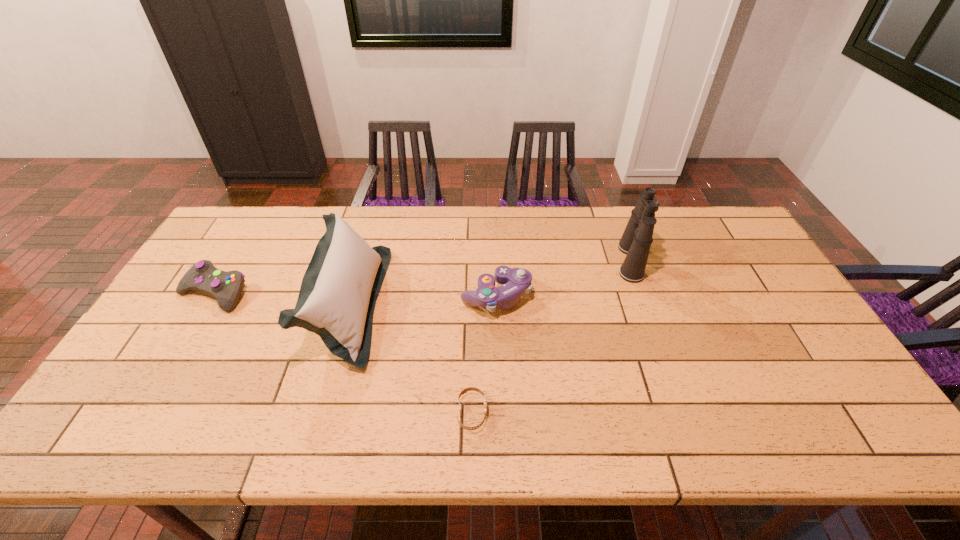
Image resolution: width=960 pixels, height=540 pixels. Find the location of `vacant space positioned 0.120m on the right of the tallest object`. vacant space positioned 0.120m on the right of the tallest object is located at coordinates (684, 261).

At what (x,y) coordinates should I click in order to perform the action: click on vacant position located 0.390m on the surface of the cushion. Please return your answer as a coordinate pair (x, y). The height and width of the screenshot is (540, 960). Looking at the image, I should click on (516, 305).

Identify the location of vacant space situated 0.090m on the back of the taller control. (494, 255).

The image size is (960, 540). Identify the location of blank area located 0.260m on the right of the shorter control. (337, 293).

At what (x,y) coordinates should I click in order to perform the action: click on blank space located 0.130m on the face of the shortest object. Please return your answer as a coordinate pair (x, y). Image resolution: width=960 pixels, height=540 pixels. Looking at the image, I should click on (542, 413).

Identify the location of object located at the far edge. (636, 240).

At what (x,y) coordinates should I click in order to perform the action: click on object situated at the near edge. Please return your answer as a coordinate pair (x, y). The image size is (960, 540). Looking at the image, I should click on (464, 390).

This screenshot has width=960, height=540. What are the coordinates of `object at the left edge` in the screenshot? It's located at (203, 277).

In the image, there is a desktop. Where is `vacant space at the far edge`? The width and height of the screenshot is (960, 540). vacant space at the far edge is located at coordinates (290, 230).

Find the location of a particular element. This screenshot has width=960, height=540. free space at the near edge of the desktop is located at coordinates (180, 422).